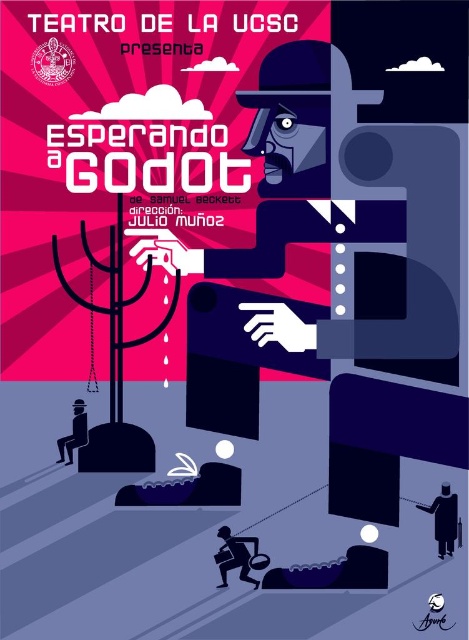
You are an usher at the theater and need to guide attendees to their seats. You see a black matte person at lower right and a matte black suit at lower left in the poster. Which object is nearer to you?

The black matte person at lower right is closer to the viewer than the matte black suit at lower left.

Where is the black matte person at lower right located in the image?

The black matte person at lower right is located at point (x=445, y=518).